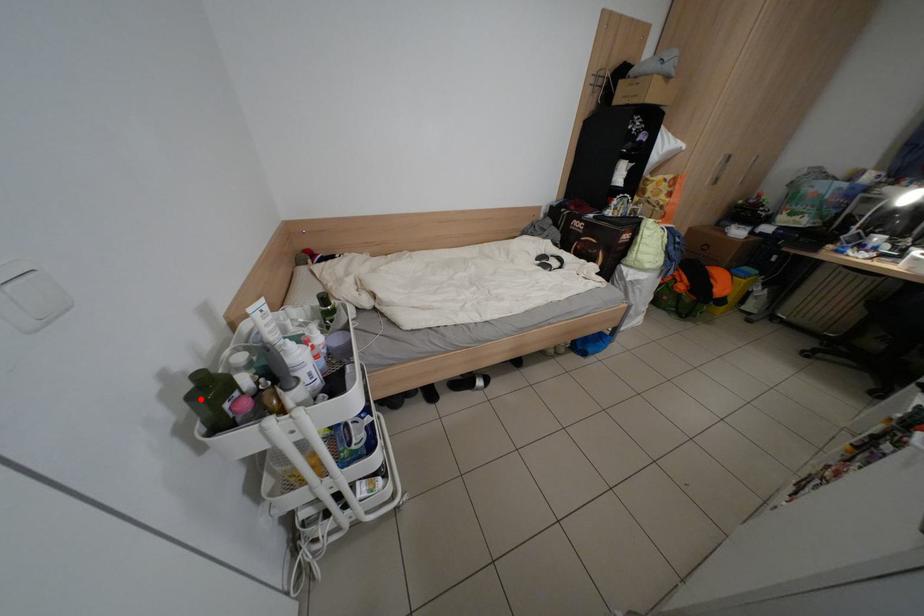
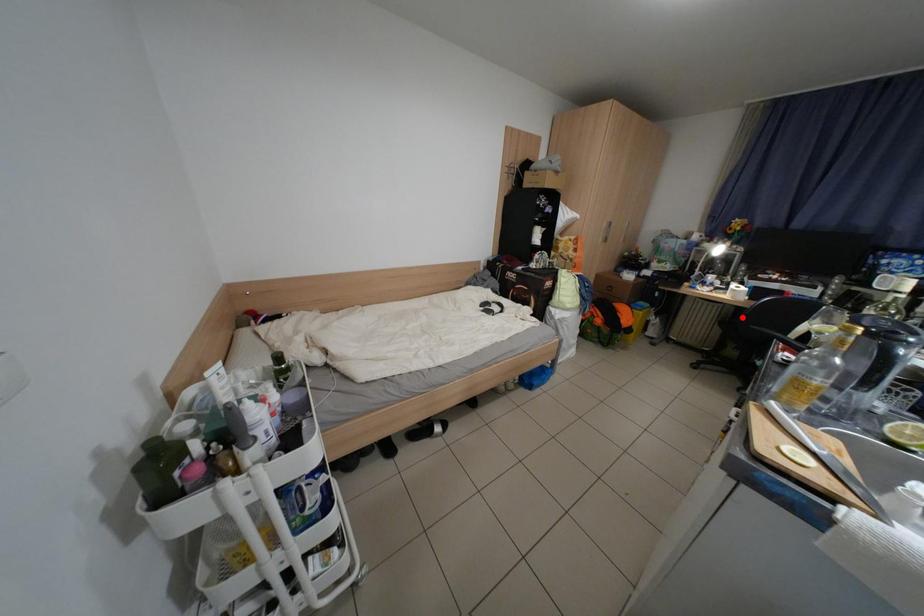
I am providing you with two images of the same scene from different viewpoints. A red point is marked on the first image and another point is marked on the second image. Is the red point in image1 aligned with the point shown in image2?

No